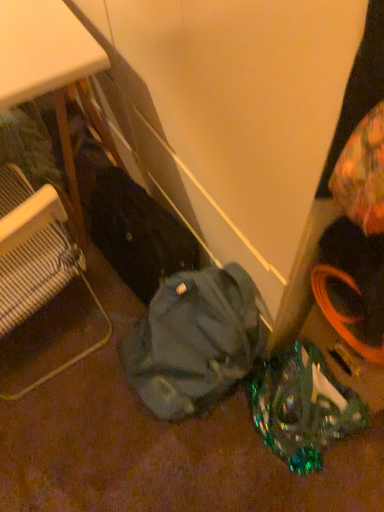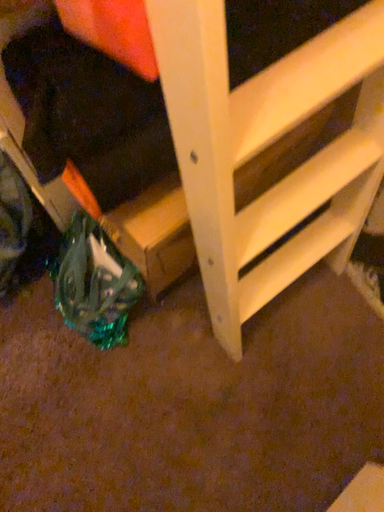
Question: How did the camera likely rotate when shooting the video?

Choices:
 (A) rotated downward
 (B) rotated upward

Answer: (A)